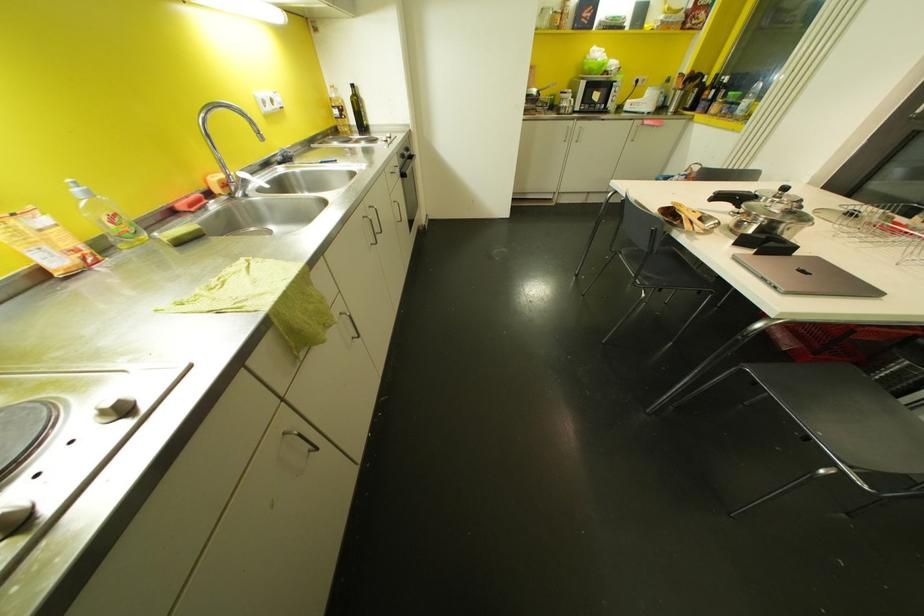
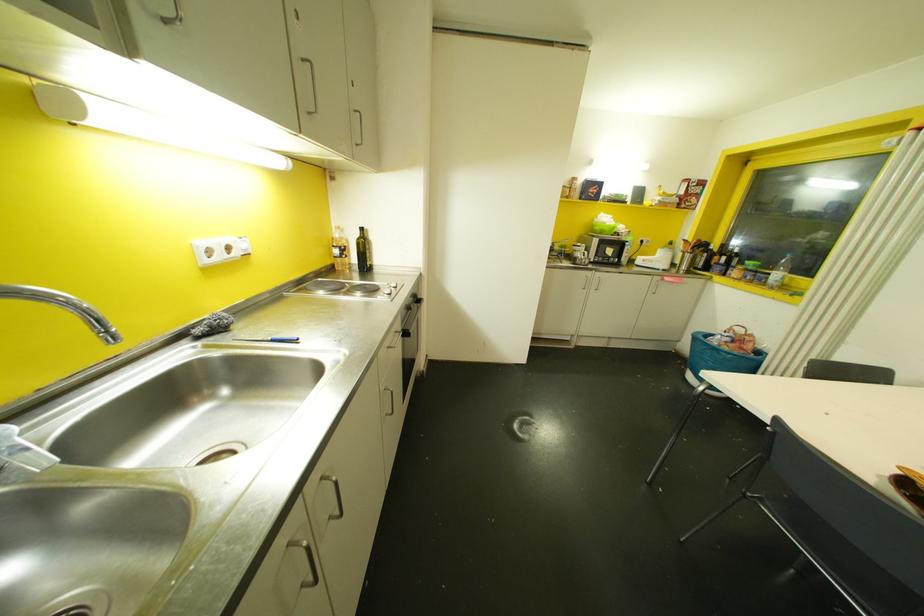
The point at (353, 84) is marked in the first image. Where is the corresponding point in the second image?

(360, 229)